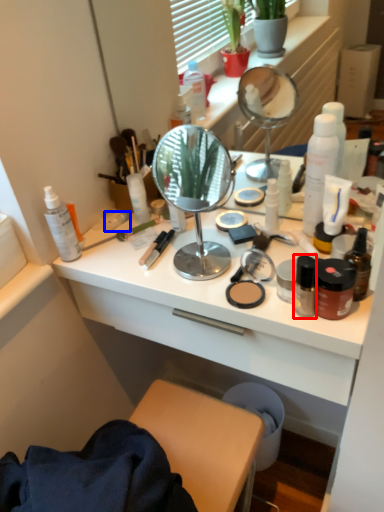
Question: Which object appears farthest to the camera in this image, toiletry (highlighted by a red box) or toiletry (highlighted by a blue box)?

Choices:
 (A) toiletry
 (B) toiletry

Answer: (B)